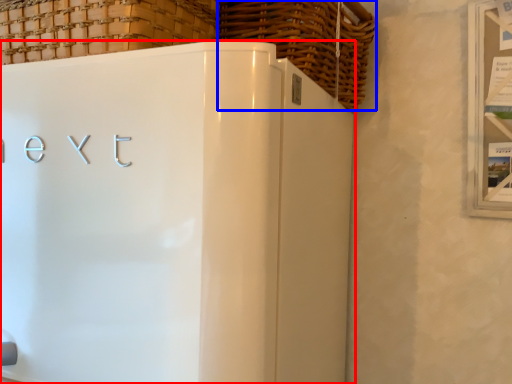
Question: Among these objects, which one is nearest to the camera, refrigerator (highlighted by a red box) or basket (highlighted by a blue box)?

Choices:
 (A) refrigerator
 (B) basket

Answer: (A)